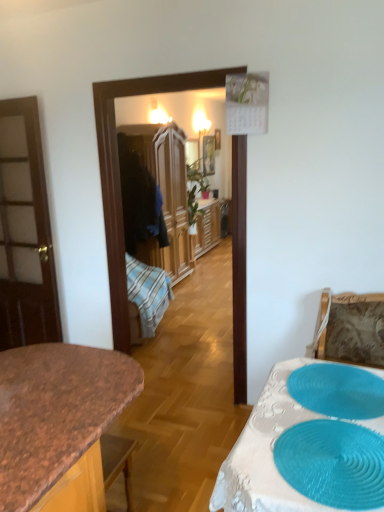
Identify the location of vacant space underneath blue textured placemat at lower right, which ranks as the first oval in back-to-front order (from a real-world perspective). (331, 388).